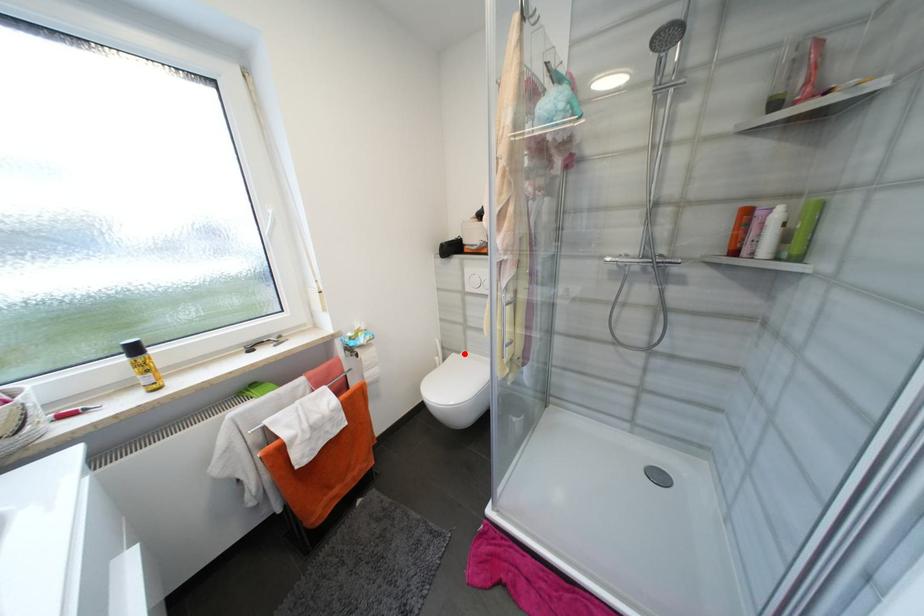
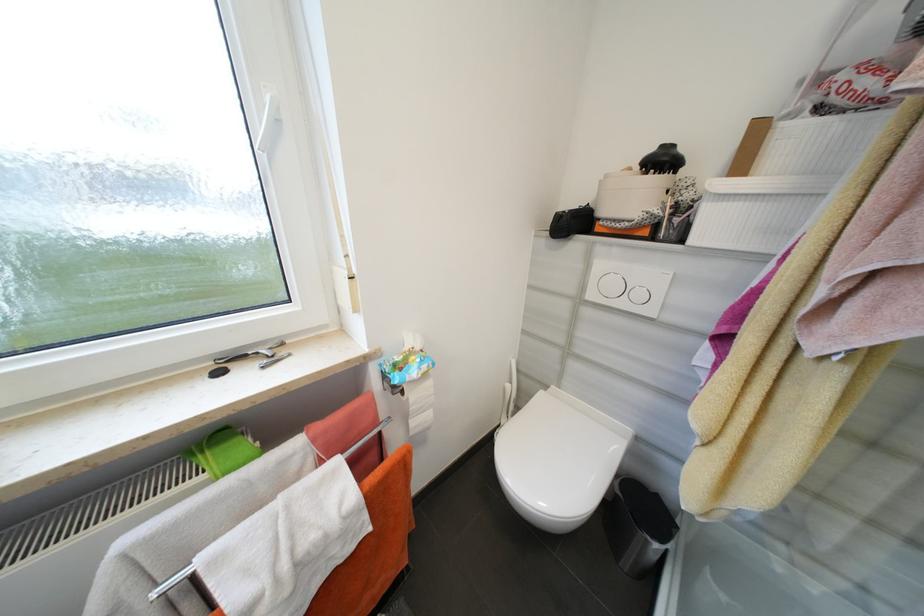
Question: I am providing you with two images of the same scene from different viewpoints. Given a red point in image1, look at the same physical point in image2. Is it:

Choices:
 (A) Closer to the viewpoint
 (B) Farther from the viewpoint

Answer: (A)